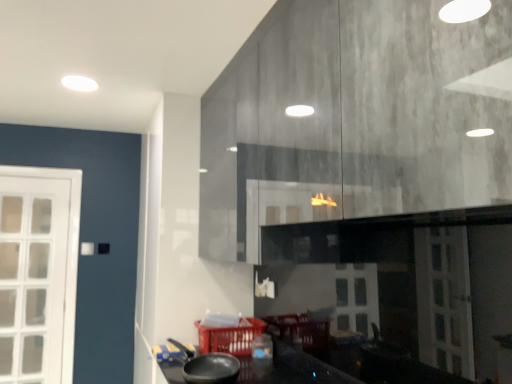
This screenshot has height=384, width=512. In order to click on vacant area on top of matte plastic basket at lower center (from a real-world perspective) in this screenshot , I will do `click(231, 321)`.